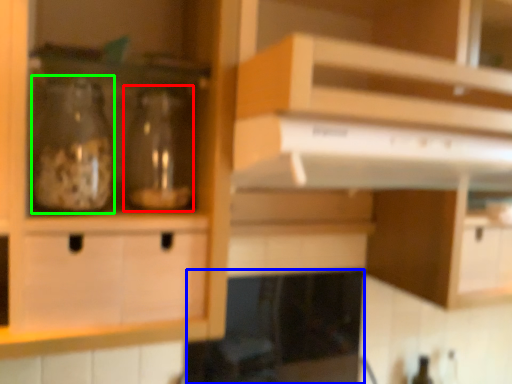
Question: Which object is the farthest from glass bottle (highlighted by a red box)? Choose among these: appliance (highlighted by a blue box) or glass bottle (highlighted by a green box).

Choices:
 (A) appliance
 (B) glass bottle

Answer: (A)